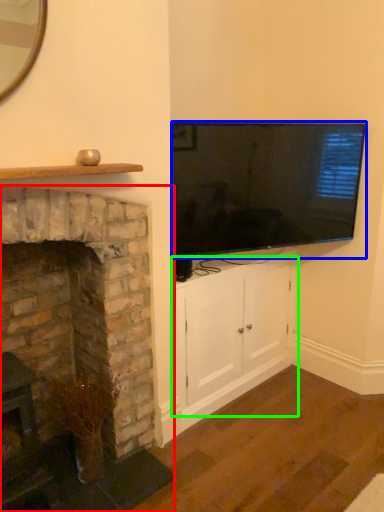
Question: Which object is the closest to the fireplace (highlighted by a red box)? Choose among these: television (highlighted by a blue box) or cabinetry (highlighted by a green box).

Choices:
 (A) television
 (B) cabinetry

Answer: (B)